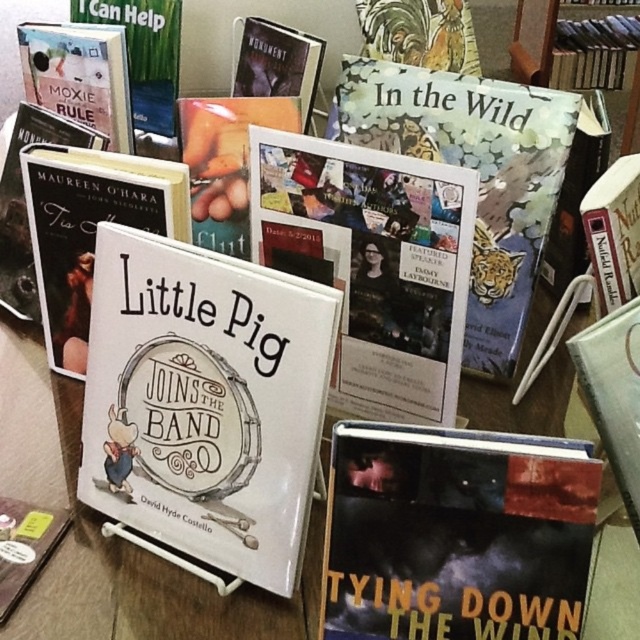
You are a librarian organizing books on a shelf. You have a white paper book at center and a hardcover book at upper left. The shelf you are placing them on has a space that is exactly 43.60 centimeters wide. Can both books fit side by side in this space?

The white paper book at center is 43.60 centimeters from the hardcover book at upper left. Since the space on the shelf is exactly 43.60 centimeters wide, there is no extra space left. Therefore, both books can just barely fit side by side in the space provided.

You are a customer in a bookstore looking for a hardcover book. You see a point marked at coordinates (477, 172). Is this point on the hardcover book at upper center?

Yes, the point at coordinates (477, 172) corresponds to the hardcover book at upper center according to the description.

You are a customer in a bookstore and see the matte white book at center. Where exactly is it located in the image?

The matte white book at center is located at point 0.359 on the x axis and 0.141 on the y axis.